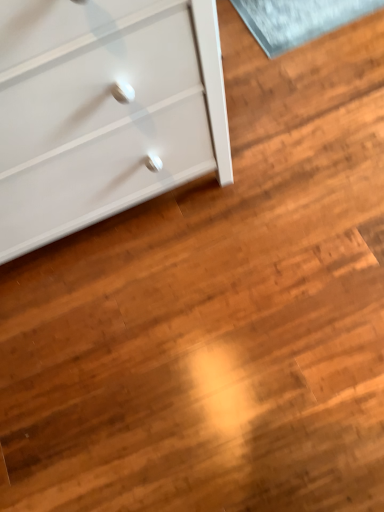
Question: Should I look upward or downward to see white glossy chest of drawers at upper left?

Choices:
 (A) up
 (B) down

Answer: (A)